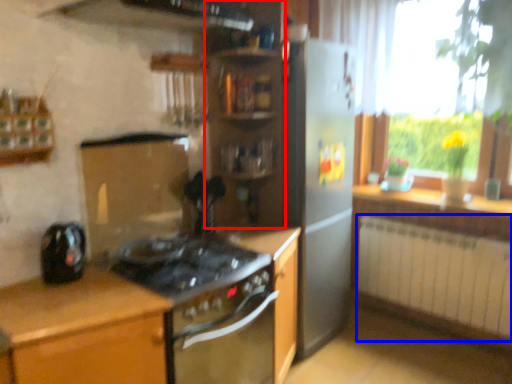
Question: Which object is further to the camera taking this photo, shelf (highlighted by a red box) or radiator (highlighted by a blue box)?

Choices:
 (A) shelf
 (B) radiator

Answer: (B)